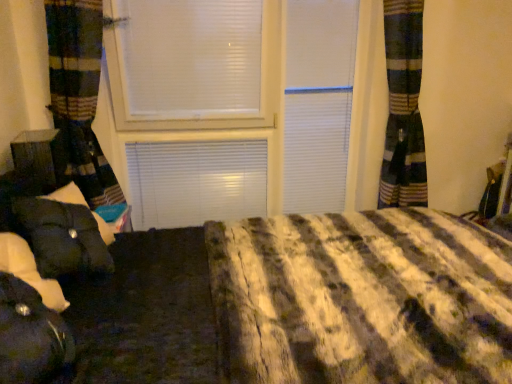
Image resolution: width=512 pixels, height=384 pixels. Describe the element at coordinates (31, 336) in the screenshot. I see `black fabric bean bag at lower left` at that location.

You are a GUI agent. You are given a task and a screenshot of the screen. Output one action in this format:
    pyautogui.click(x=<x>, y=<y>)
    Task: Click on the black fabric bean bag at lower left
    Image resolution: width=512 pixels, height=384 pixels.
    Given the screenshot: What is the action you would take?
    pyautogui.click(x=31, y=336)

What do you see at coordinates (40, 157) in the screenshot?
I see `matte black suitcase at left` at bounding box center [40, 157].

At what (x,y) coordinates should I click in order to perform the action: click on matte black suitcase at left. Please return your answer as a coordinate pair (x, y). The height and width of the screenshot is (384, 512). Looking at the image, I should click on (40, 157).

In order to click on black fabric bean bag at lower left in this screenshot , I will do `click(31, 336)`.

Considering the relative positions of black fabric bean bag at lower left and matte black suitcase at left in the image provided, is black fabric bean bag at lower left to the left or to the right of matte black suitcase at left?

From the image, it's evident that black fabric bean bag at lower left is to the right of matte black suitcase at left.

Considering their positions, is black fabric bean bag at lower left located in front of or behind matte black suitcase at left?

black fabric bean bag at lower left is in front of matte black suitcase at left.

Does point (28, 362) lie in front of point (20, 170)?

Yes, point (28, 362) is in front of point (20, 170).

Based on the photo, from the image's perspective, is black fabric bean bag at lower left beneath matte black suitcase at left?

Indeed, from the image's perspective, black fabric bean bag at lower left is shown beneath matte black suitcase at left.

From a real-world perspective, is black fabric bean bag at lower left positioned above or below matte black suitcase at left?

black fabric bean bag at lower left is below matte black suitcase at left.

Between black fabric bean bag at lower left and matte black suitcase at left, which one has larger width?

black fabric bean bag at lower left is wider.

Considering the sizes of objects black fabric bean bag at lower left and matte black suitcase at left in the image provided, who is shorter, black fabric bean bag at lower left or matte black suitcase at left?

With less height is matte black suitcase at left.

Who is smaller, black fabric bean bag at lower left or matte black suitcase at left?

matte black suitcase at left is smaller.

Is black fabric bean bag at lower left positioned beyond the bounds of matte black suitcase at left?

Yes, black fabric bean bag at lower left is outside of matte black suitcase at left.

Is black fabric bean bag at lower left next to matte black suitcase at left?

No, black fabric bean bag at lower left is not with matte black suitcase at left.

Is matte black suitcase at left at the back of black fabric bean bag at lower left?

black fabric bean bag at lower left is not turned away from matte black suitcase at left.

How many degrees apart are the facing directions of black fabric bean bag at lower left and matte black suitcase at left?

11.4 degrees.

Image resolution: width=512 pixels, height=384 pixels. Identify the location of bean bag chair in front of the matte black suitcase at left. (31, 336).

Based on the photo, would you say matte black suitcase at left is to the left or to the right of black fabric bean bag at lower left in the picture?

From the image, it's evident that matte black suitcase at left is to the left of black fabric bean bag at lower left.

Relative to black fabric bean bag at lower left, is matte black suitcase at left in front or behind?

matte black suitcase at left is positioned farther from the viewer than black fabric bean bag at lower left.

Is point (15, 144) farther from viewer compared to point (46, 368)?

That is True.

From the image's perspective, which one is positioned lower, matte black suitcase at left or black fabric bean bag at lower left?

black fabric bean bag at lower left.

From a real-world perspective, which object stands above the other?

matte black suitcase at left is physically above.

Is matte black suitcase at left thinner than black fabric bean bag at lower left?

Yes, matte black suitcase at left is thinner than black fabric bean bag at lower left.

Who is taller, matte black suitcase at left or black fabric bean bag at lower left?

Standing taller between the two is black fabric bean bag at lower left.

Who is smaller, matte black suitcase at left or black fabric bean bag at lower left?

Smaller between the two is matte black suitcase at left.

Is black fabric bean bag at lower left completely or partially inside matte black suitcase at left?

Actually, black fabric bean bag at lower left is outside matte black suitcase at left.

Is matte black suitcase at left not close to black fabric bean bag at lower left?

No.

Is matte black suitcase at left facing towards black fabric bean bag at lower left?

Result: No.

How many degrees apart are the facing directions of matte black suitcase at left and black fabric bean bag at lower left?

matte black suitcase at left and black fabric bean bag at lower left are facing 11.4 degrees away from each other.

This screenshot has width=512, height=384. I want to click on bean bag chair in front of the matte black suitcase at left, so click(31, 336).

Where is `furniture above the black fabric bean bag at lower left (from the image's perspective)`? This screenshot has width=512, height=384. furniture above the black fabric bean bag at lower left (from the image's perspective) is located at coordinates (40, 157).

Where is `bean bag chair lying in front of the matte black suitcase at left`? bean bag chair lying in front of the matte black suitcase at left is located at coordinates (31, 336).